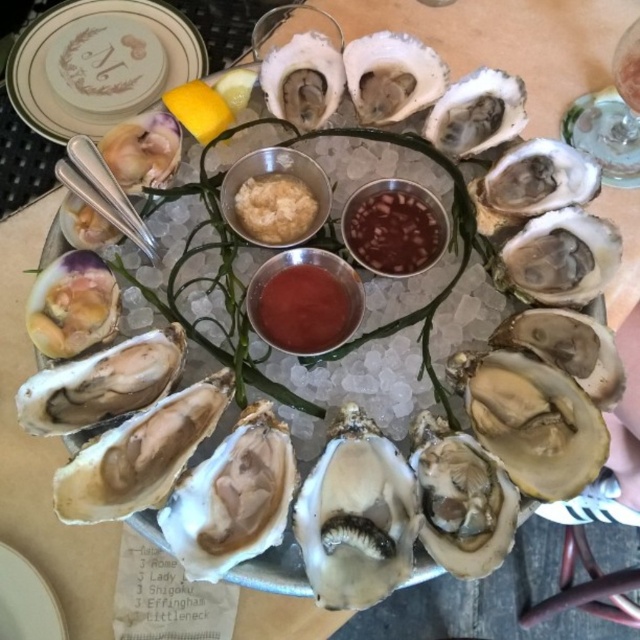
Question: Among these points, which one is farthest from the camera?

Choices:
 (A) (186, 97)
 (B) (284, 198)
 (C) (385, 266)

Answer: (A)

Question: Which point is closer to the camera taking this photo?

Choices:
 (A) (186, 109)
 (B) (13, 566)
 (C) (312, 289)
 (D) (298, 205)

Answer: (C)

Question: Is white creamy sauce at center closer to the viewer compared to white ceramic plate at lower left?

Choices:
 (A) yes
 (B) no

Answer: (A)

Question: Does white creamy sauce at center have a larger size compared to yellow matte lemon at upper center?

Choices:
 (A) no
 (B) yes

Answer: (B)

Question: Among these objects, which one is farthest from the camera?

Choices:
 (A) white creamy sauce at center
 (B) white ceramic plate at lower left
 (C) matte white plate at upper left
 (D) smokey brown paste at center

Answer: (C)

Question: Considering the relative positions of smokey brown paste at center and yellow matte lemon at upper center in the image provided, where is smokey brown paste at center located with respect to yellow matte lemon at upper center?

Choices:
 (A) right
 (B) left

Answer: (A)